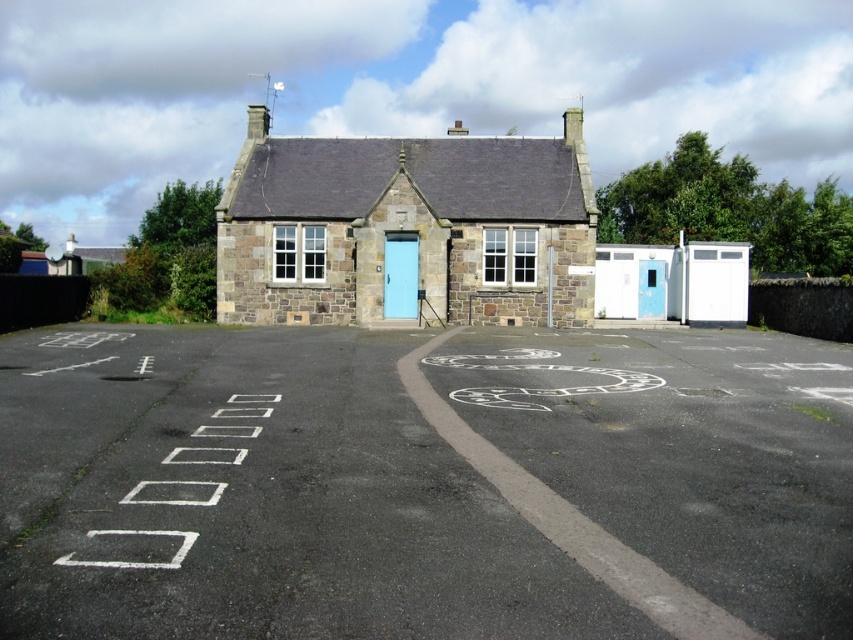
You are standing in front of the stone building and want to walk towards the paved area. There are two points marked on the ground, point (389, 365) and point (397, 278). Which point is closer to you?

Point (389, 365) is closer to the viewer than point (397, 278).

You are a delivery driver approaching the building and need to park in the parking lot. The parking space you want to use is at point (422, 483). What is the color of the parking space at that point?

The parking space at point (422, 483) is white asphalt parking lot at center.

You are a delivery driver approaching the building and need to park your vehicle. The parking spot is marked by white lines on the white asphalt parking lot at center. The light blue wooden door at center is where you need to unload. Which side of the door should you park on?

The white asphalt parking lot at center is to the left of the light blue wooden door at center, so you should park to the left side of the door to be closest to the unloading area.